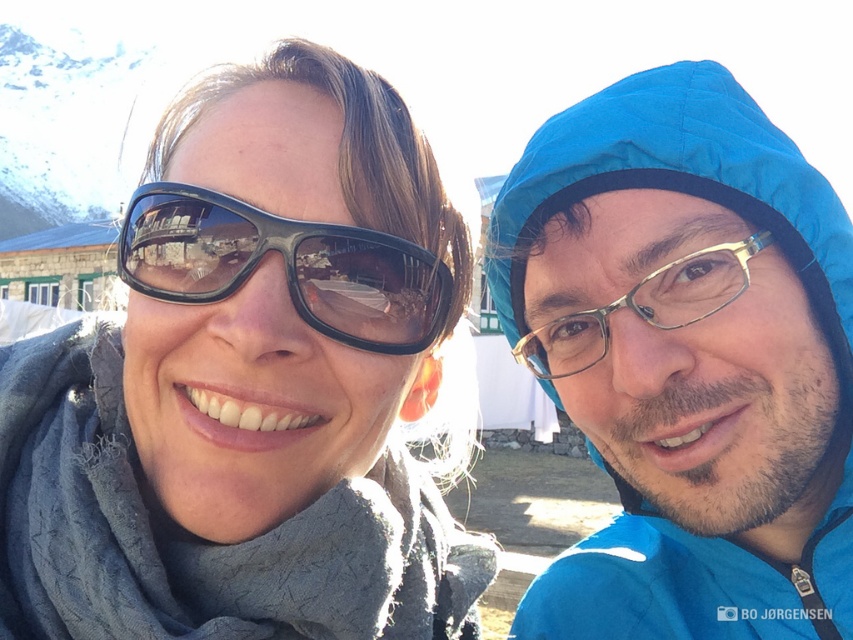
You are a photographer trying to capture a photo of both the blue quilted raincoat at upper right and the black matte goggles at left. Based on their positions, which object is located more to the right in the image?

The blue quilted raincoat at upper right is positioned on the right side of black matte goggles at left, so the blue quilted raincoat at upper right is more to the right.

You are a photographer trying to capture a closeup of the matte black sunglasses at upper left and the blue quilted raincoat at upper right in the image. Since the camera can only focus on one object at a time, which object should you choose to ensure it appears larger in the photo?

The matte black sunglasses at upper left is bigger than the blue quilted raincoat at upper right, so you should choose the matte black sunglasses at upper left to ensure it appears larger in the photo.

You are a photographer trying to capture a closeup of the matte black sunglasses at upper left without the blue quilted raincoat at upper right appearing in the frame. Is this possible given their positions?

The matte black sunglasses at upper left is positioned over the blue quilted raincoat at upper right, so it is likely blocking the view of the raincoat. Therefore, you can take a closeup of the matte black sunglasses at upper left without the blue quilted raincoat at upper right appearing in the frame.